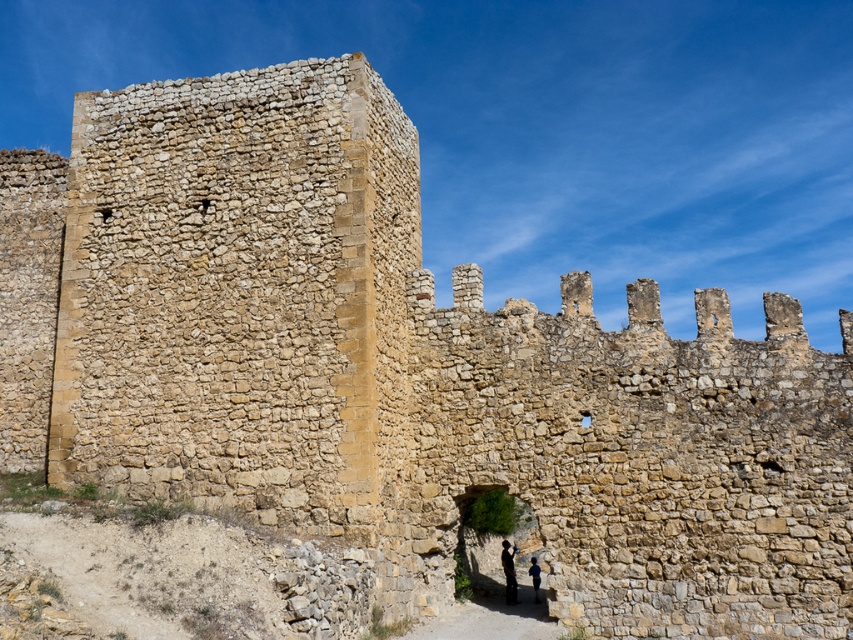
At what (x,y) coordinates should I click in order to perform the action: click on dark blue fabric at center. Please return your answer as a coordinate pair (x, y). Looking at the image, I should click on (508, 572).

Can you confirm if dark blue fabric at center is wider than blue fabric at lower center?

Yes, dark blue fabric at center is wider than blue fabric at lower center.

This screenshot has width=853, height=640. Identify the location of dark blue fabric at center. (508, 572).

Find the location of a particular element. The image size is (853, 640). dark blue fabric at center is located at coordinates (508, 572).